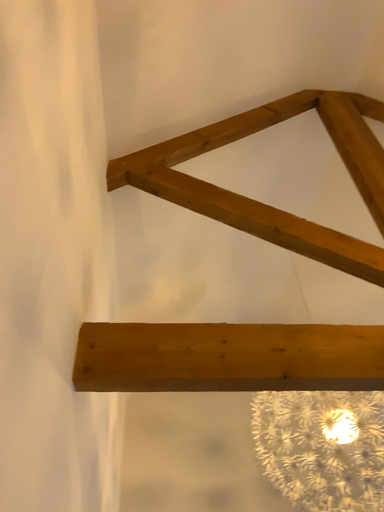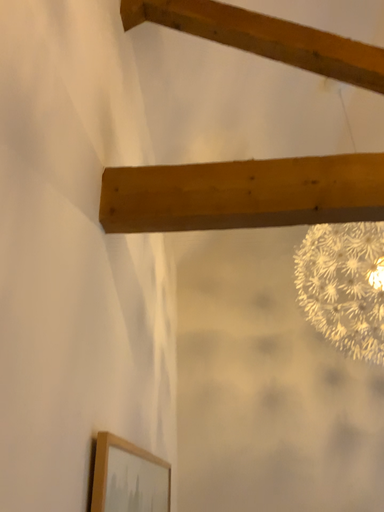
Question: Which way did the camera rotate in the video?

Choices:
 (A) rotated left
 (B) rotated right

Answer: (A)